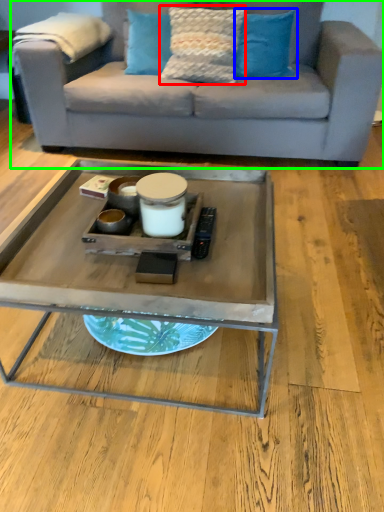
Question: Estimate the real-world distances between objects in this image. Which object is closer to pillow (highlighted by a red box), pillow (highlighted by a blue box) or studio couch (highlighted by a green box)?

Choices:
 (A) pillow
 (B) studio couch

Answer: (A)